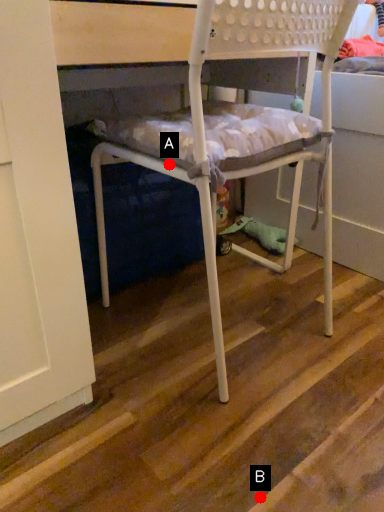
Question: Two points are circled on the image, labeled by A and B beside each circle. Which of the following is the closest to the observer?

Choices:
 (A) A is closer
 (B) B is closer

Answer: (B)